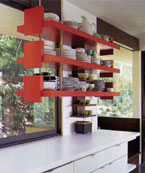
Locate an element on the screen. The width and height of the screenshot is (145, 173). stack of plates is located at coordinates (69, 53), (51, 53), (83, 58), (72, 84).